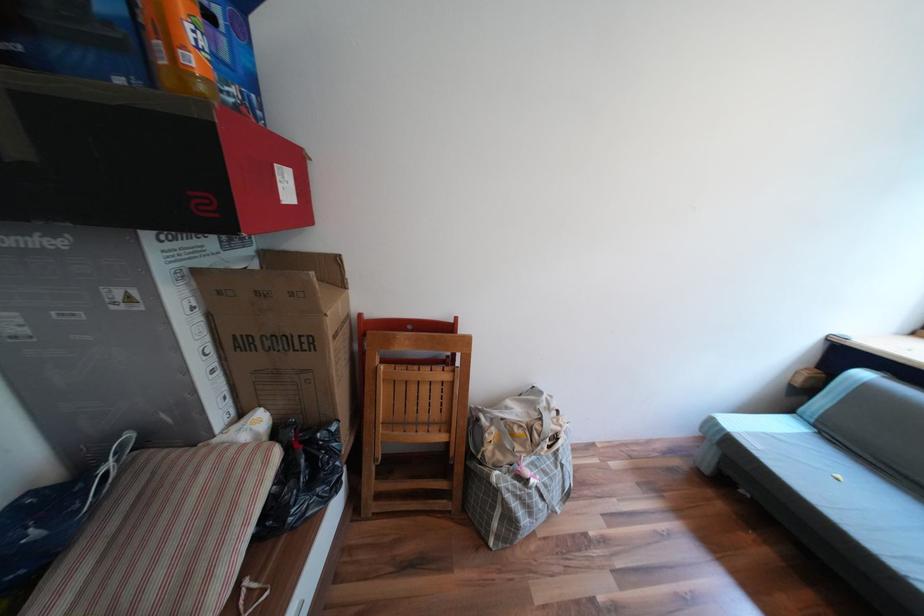
This screenshot has height=616, width=924. Find the location of `large cardboard box`. large cardboard box is located at coordinates (285, 334).